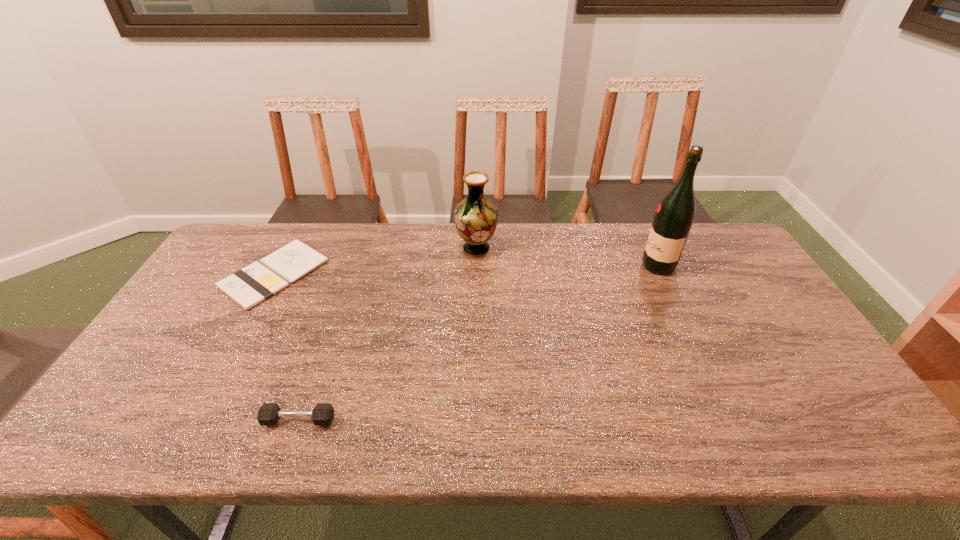
Locate an element on the screen. The height and width of the screenshot is (540, 960). vacant space at the near edge is located at coordinates (612, 430).

The image size is (960, 540). I want to click on vacant space at the right edge, so click(767, 320).

The width and height of the screenshot is (960, 540). Identify the location of free region at the far left corner. (235, 245).

I want to click on blank region between the third tallest object and the notepad, so click(286, 347).

The width and height of the screenshot is (960, 540). I want to click on free spot between the shortest object and the third tallest object, so click(286, 347).

Locate an element on the screen. Image resolution: width=960 pixels, height=540 pixels. empty space that is in between the liquor and the shortest object is located at coordinates (467, 270).

The image size is (960, 540). Identify the location of vacant region between the third object from left to right and the notepad. (375, 261).

Locate an element on the screen. free space between the notepad and the third tallest object is located at coordinates tap(286, 347).

Where is `free space that is in between the dumbbell and the rightmost object`? This screenshot has height=540, width=960. free space that is in between the dumbbell and the rightmost object is located at coordinates (478, 343).

Locate an element on the screen. unoccupied position between the notepad and the second object from right to left is located at coordinates (375, 261).